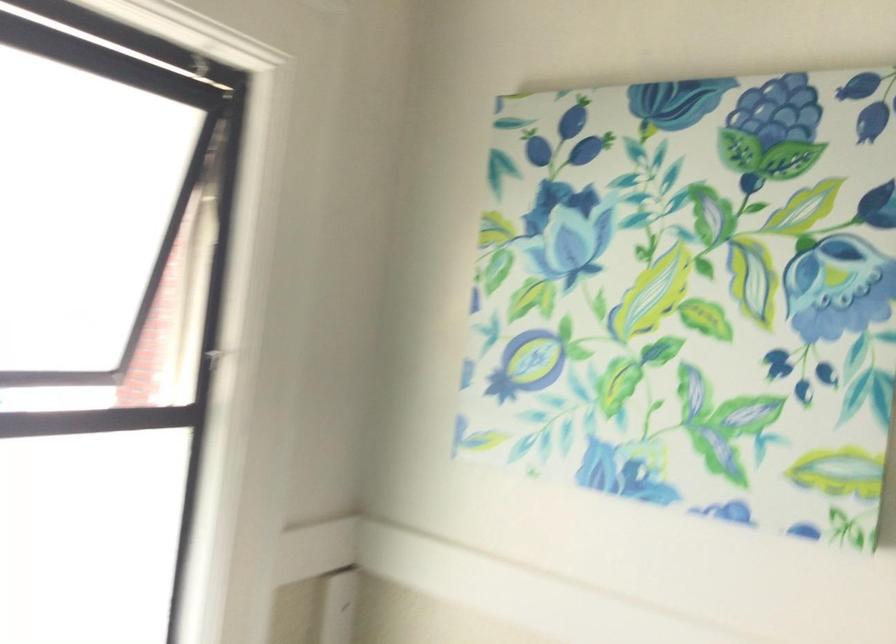
Which object does [693,292] point to?

This point indicates the floral canvas art.